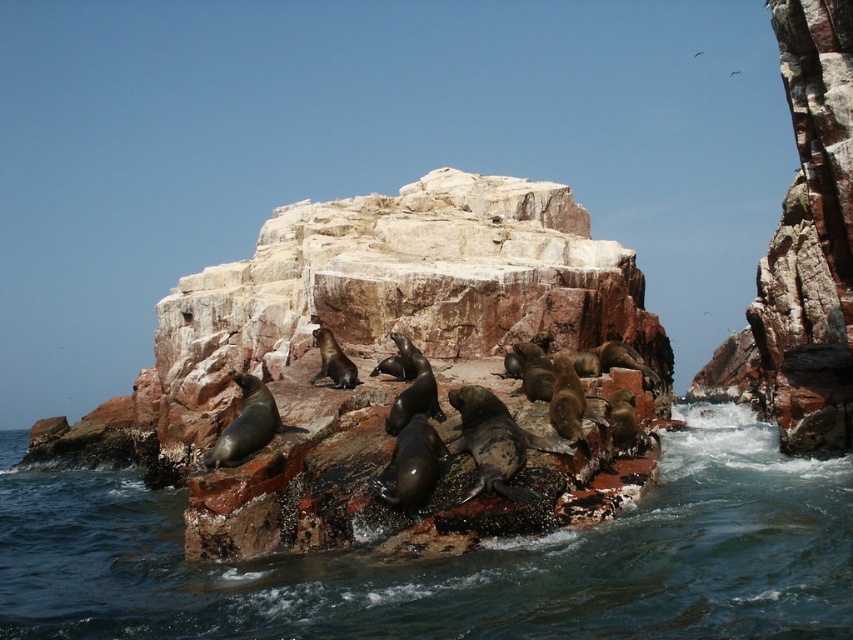
Does smooth rock water at center have a lesser height compared to rusty rock at upper right?

Yes.

Can you confirm if smooth rock water at center is taller than rusty rock at upper right?

No, smooth rock water at center is not taller than rusty rock at upper right.

Describe the element at coordinates (456, 561) in the screenshot. The width and height of the screenshot is (853, 640). I see `smooth rock water at center` at that location.

What are the coordinates of `smooth rock water at center` in the screenshot? It's located at (456, 561).

Which is more to the right, rustic stone rock at center or rusty rock at upper right?

From the viewer's perspective, rusty rock at upper right appears more on the right side.

Locate an element on the screen. The height and width of the screenshot is (640, 853). rustic stone rock at center is located at coordinates (364, 339).

Locate an element on the screen. The width and height of the screenshot is (853, 640). rustic stone rock at center is located at coordinates (364, 339).

Who is shorter, rustic stone rock at center or smooth rock water at center?

Standing shorter between the two is smooth rock water at center.

Is rustic stone rock at center smaller than smooth rock water at center?

No.

Who is more distant from viewer, (476,227) or (96,573)?

The point (476,227) is behind.

The width and height of the screenshot is (853, 640). What are the coordinates of `rustic stone rock at center` in the screenshot? It's located at (364, 339).